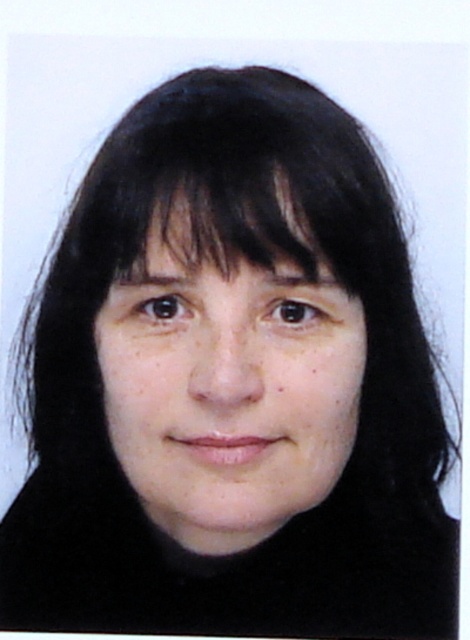
Does smooth skin face at center have a greater height compared to black matte hair at upper center?

Yes, smooth skin face at center is taller than black matte hair at upper center.

Is smooth skin face at center below black matte hair at upper center?

Yes, smooth skin face at center is below black matte hair at upper center.

Is point (180, 529) closer to viewer compared to point (331, 280)?

No, it is behind (331, 280).

The width and height of the screenshot is (470, 640). In order to click on smooth skin face at center in this screenshot , I will do `click(227, 384)`.